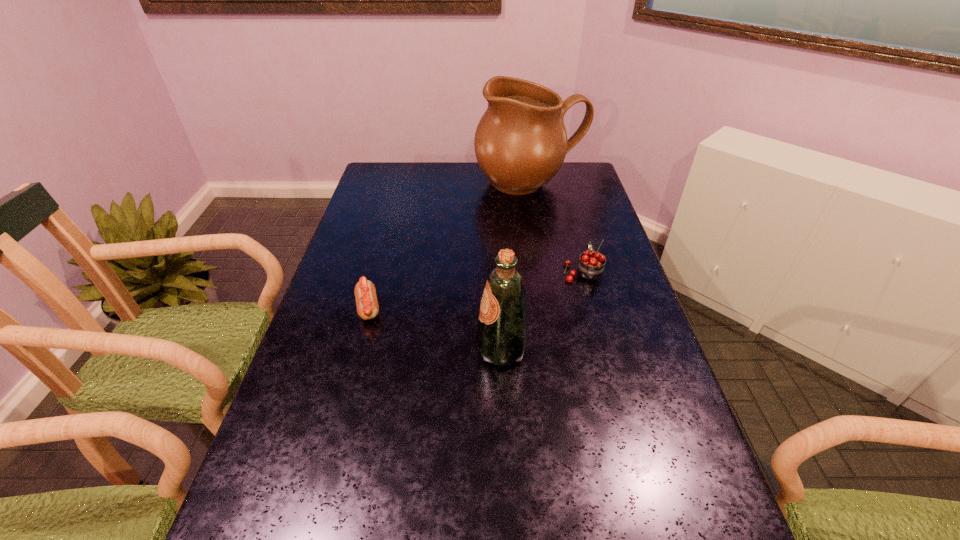
This screenshot has height=540, width=960. In order to click on the farthest object in this screenshot , I will do `click(520, 143)`.

Locate an element on the screen. This screenshot has height=540, width=960. cream pitcher is located at coordinates (520, 143).

Identify the location of the third shortest object. (502, 337).

Where is `the nearest object`? the nearest object is located at coordinates (502, 337).

The image size is (960, 540). I want to click on cherry, so click(x=591, y=266).

At what (x,y) coordinates should I click in order to perform the action: click on the third tallest object. Please return your answer as a coordinate pair (x, y). The height and width of the screenshot is (540, 960). Looking at the image, I should click on (591, 266).

Locate an element on the screen. The width and height of the screenshot is (960, 540). the shortest object is located at coordinates (365, 292).

Where is `the third farthest object`? the third farthest object is located at coordinates (365, 292).

This screenshot has height=540, width=960. In order to click on free spot located at the spout of the tallest object in this screenshot , I will do (544, 262).

Image resolution: width=960 pixels, height=540 pixels. In order to click on blank space located 0.050m on the front-facing side of the third shortest object in this screenshot , I will do `click(456, 349)`.